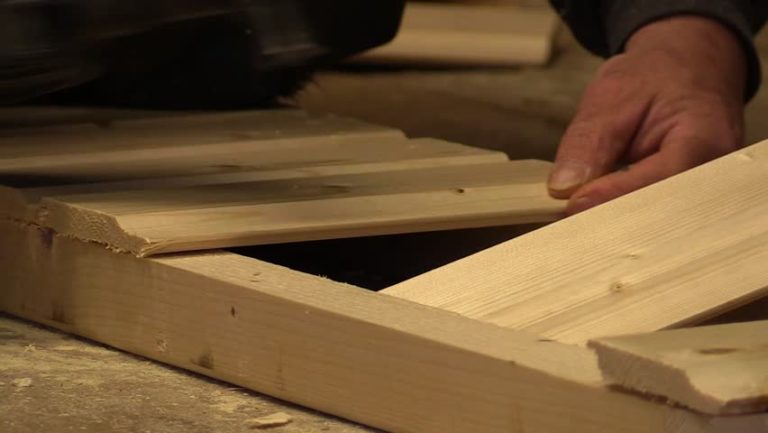
Locate an element on the screen. This screenshot has height=433, width=768. trimmed boards is located at coordinates (709, 356), (661, 280), (310, 192), (227, 142).